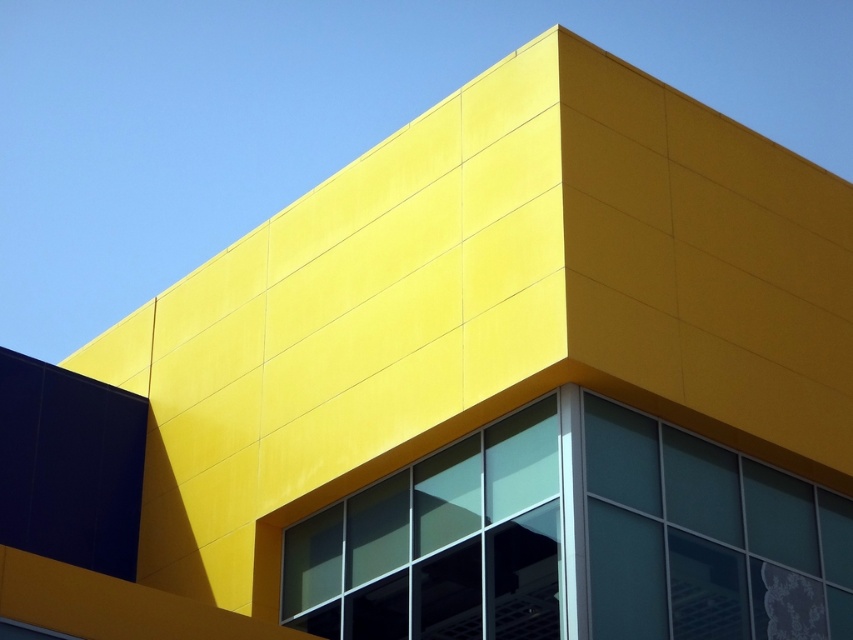
Question: Is clear glass window at center positioned before transparent glass window at lower right?

Choices:
 (A) yes
 (B) no

Answer: (A)

Question: Which point appears farthest from the camera in this image?

Choices:
 (A) (355, 593)
 (B) (428, 605)

Answer: (A)

Question: Which of the following is the farthest from the observer?

Choices:
 (A) clear glass window at center
 (B) transparent glass window at center
 (C) transparent glass window at lower right

Answer: (B)

Question: Which of these objects is positioned closest to the transparent glass window at center?

Choices:
 (A) clear glass window at center
 (B) transparent glass window at lower right

Answer: (A)

Question: Does clear glass window at center have a lesser width compared to transparent glass window at lower right?

Choices:
 (A) yes
 (B) no

Answer: (B)

Question: Can you confirm if clear glass window at center is positioned above transparent glass window at center?

Choices:
 (A) yes
 (B) no

Answer: (A)